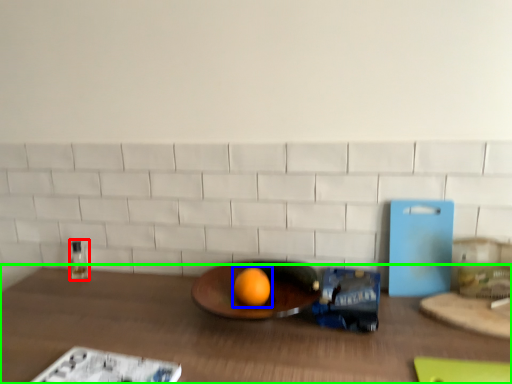
Question: Based on their relative distances, which object is farther from bottle (highlighted by a red box)? Choose from grapefruit (highlighted by a blue box) and table (highlighted by a green box).

Choices:
 (A) grapefruit
 (B) table

Answer: (A)